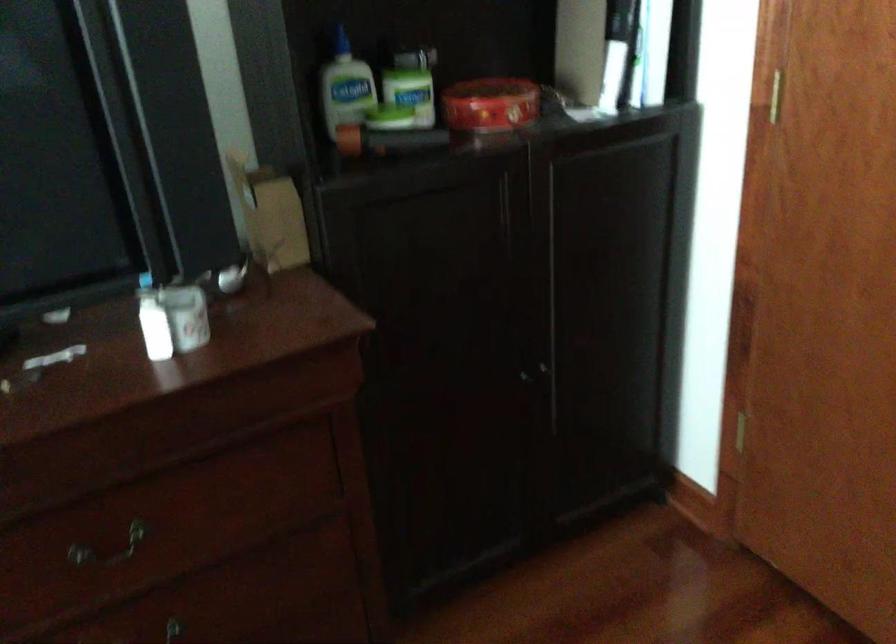
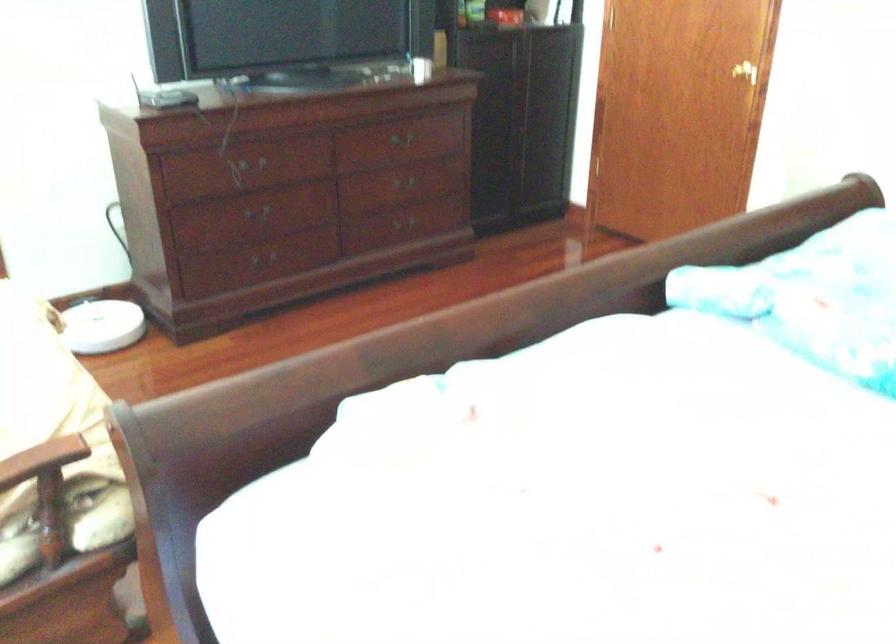
Where in the second image is the point corresponding to pixel 159 529 from the first image?

(401, 138)